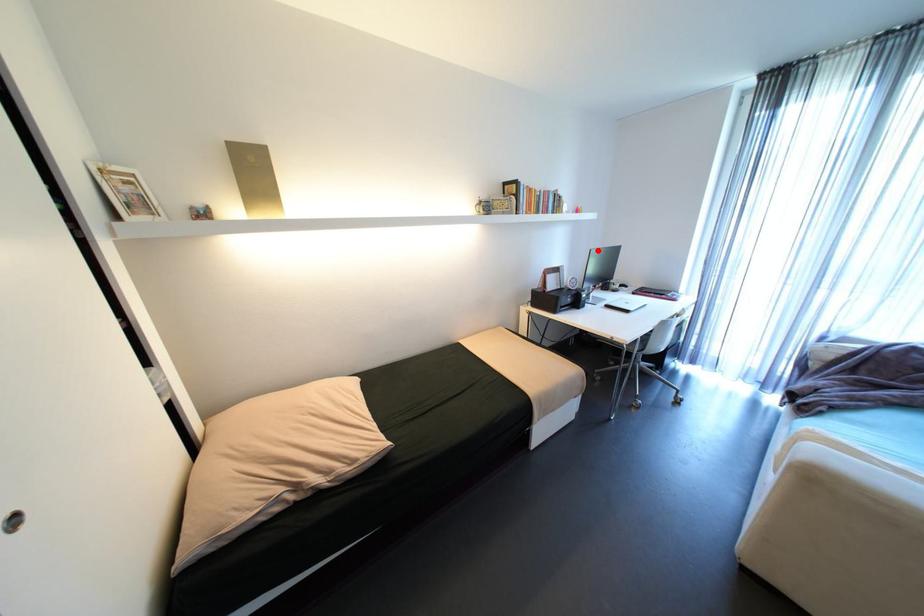
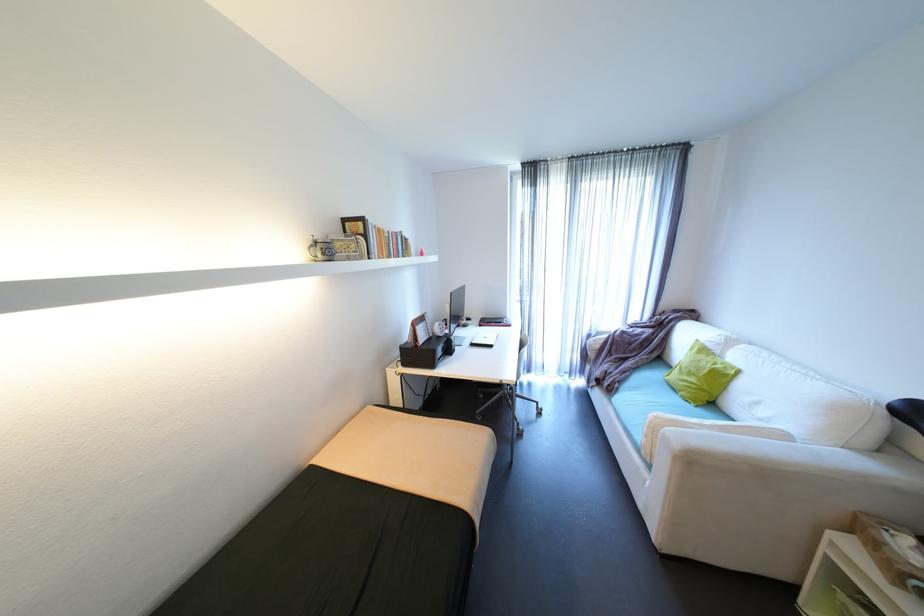
Find the pixel in the second image that matches the highlighted location in the first image.

(458, 294)